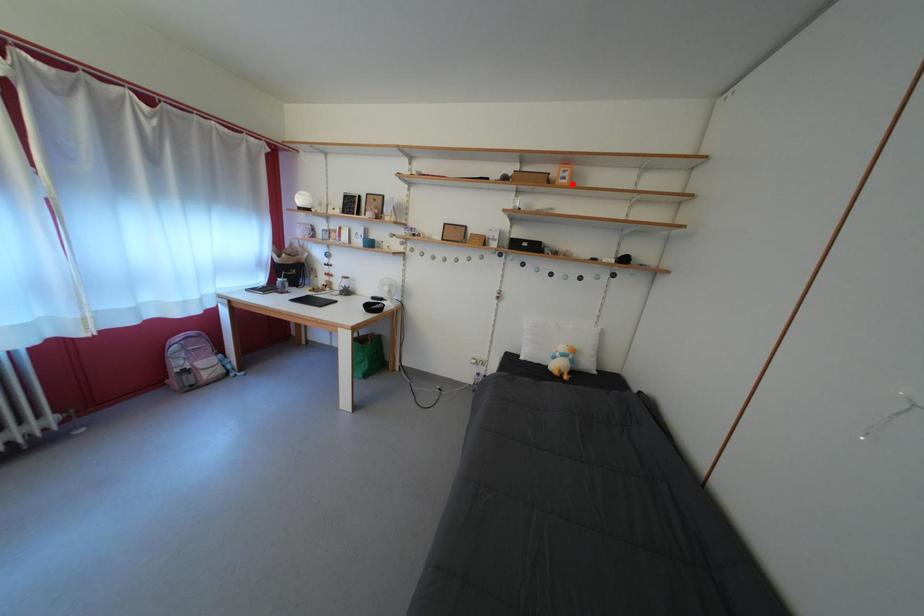
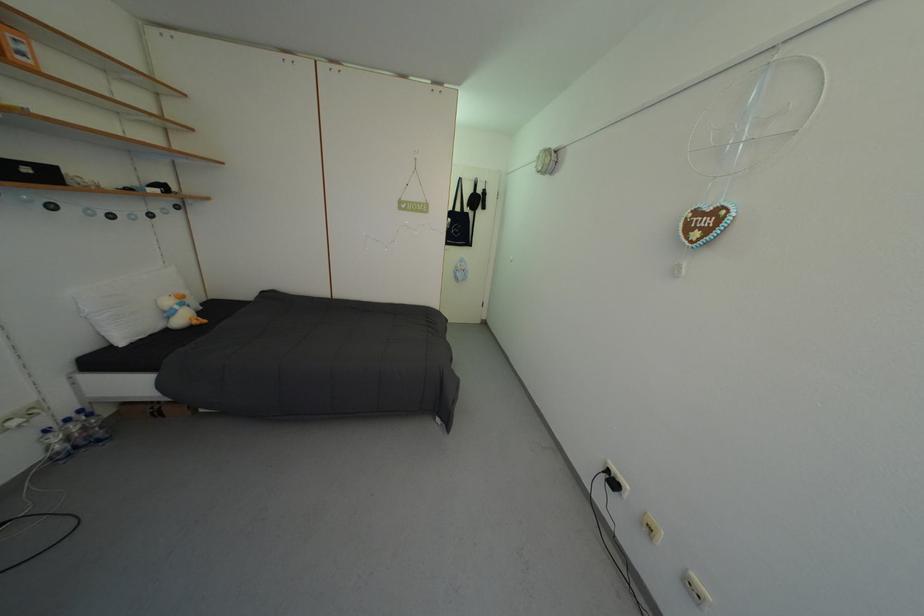
Locate, in the second image, the point that corresponds to the highlighted location in the first image.

(30, 60)